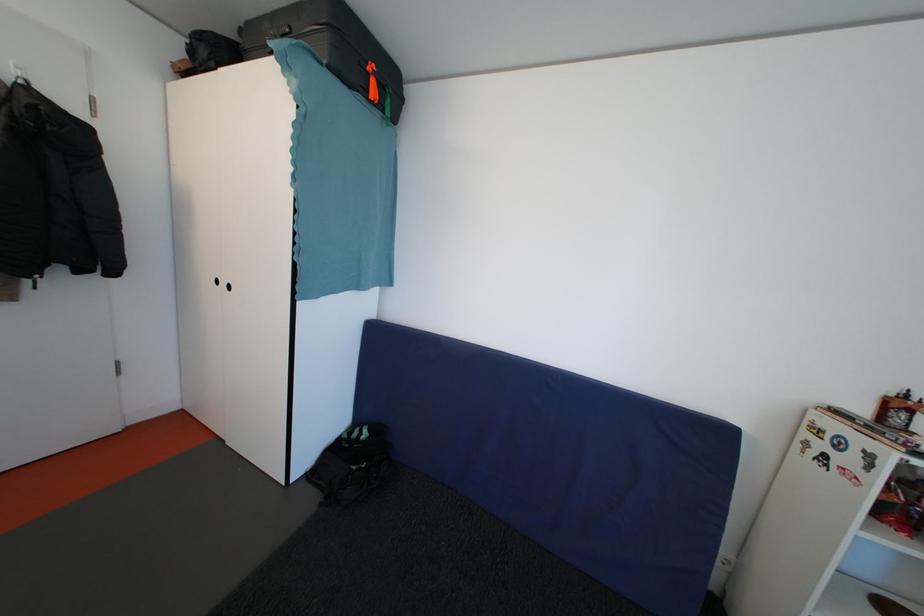
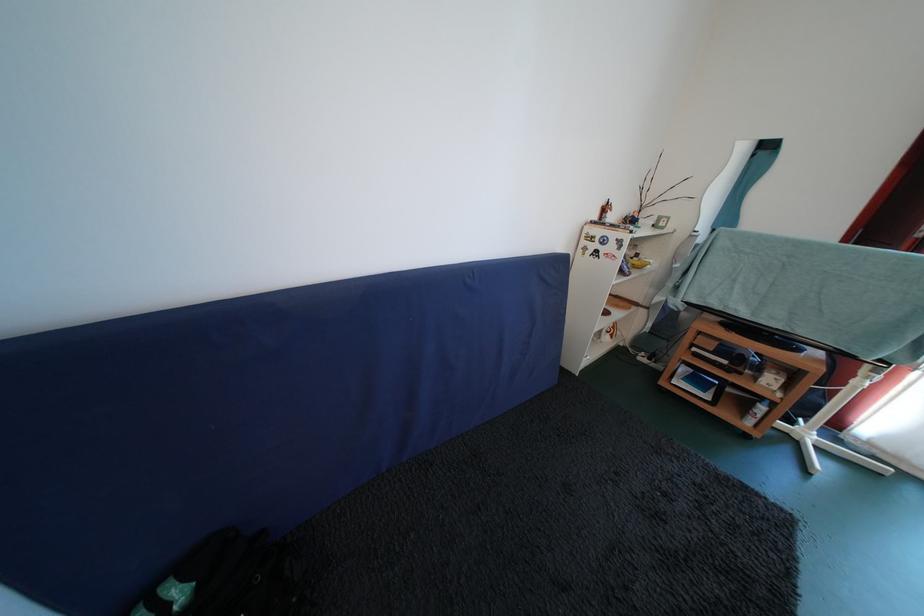
The images are taken continuously from a first-person perspective. In which direction is your viewpoint rotating?

The camera's rotation is toward right-down.